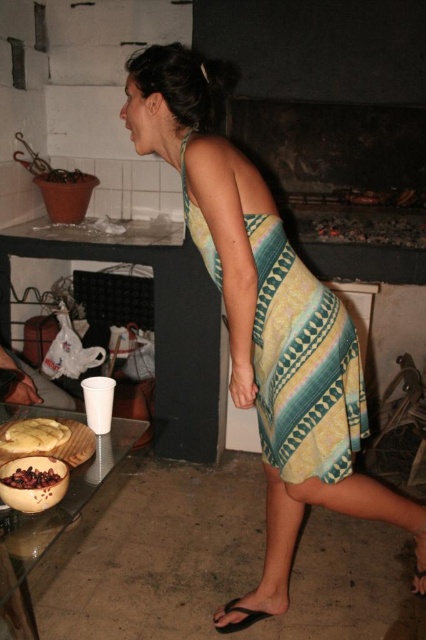
Is yellow-green striped dress at center wider than yellow-green printed dress at center?

Yes, yellow-green striped dress at center is wider than yellow-green printed dress at center.

Which is above, yellow-green striped dress at center or yellow-green printed dress at center?

yellow-green printed dress at center is above.

I want to click on yellow-green striped dress at center, so click(267, 317).

Can you confirm if yellow matte bread at lower left is positioned to the right of black rubber sandal at lower center?

Incorrect, yellow matte bread at lower left is not on the right side of black rubber sandal at lower center.

Measure the distance between yellow matte bread at lower left and camera.

yellow matte bread at lower left and camera are 4.37 feet apart from each other.

What do you see at coordinates (34, 435) in the screenshot? This screenshot has height=640, width=426. I see `yellow matte bread at lower left` at bounding box center [34, 435].

Identify the location of yellow matte bread at lower left. (34, 435).

Is yellow-green printed dress at center taller than yellow matte bread at lower left?

Yes, yellow-green printed dress at center is taller than yellow matte bread at lower left.

Between yellow-green printed dress at center and yellow matte bread at lower left, which one is positioned lower?

yellow matte bread at lower left is below.

You are a GUI agent. You are given a task and a screenshot of the screen. Output one action in this format:
    pyautogui.click(x=<x>, y=<y>)
    Task: Click on the yellow-green printed dress at center
    Image resolution: width=426 pixels, height=640 pixels.
    Given the screenshot: What is the action you would take?
    pyautogui.click(x=302, y=364)